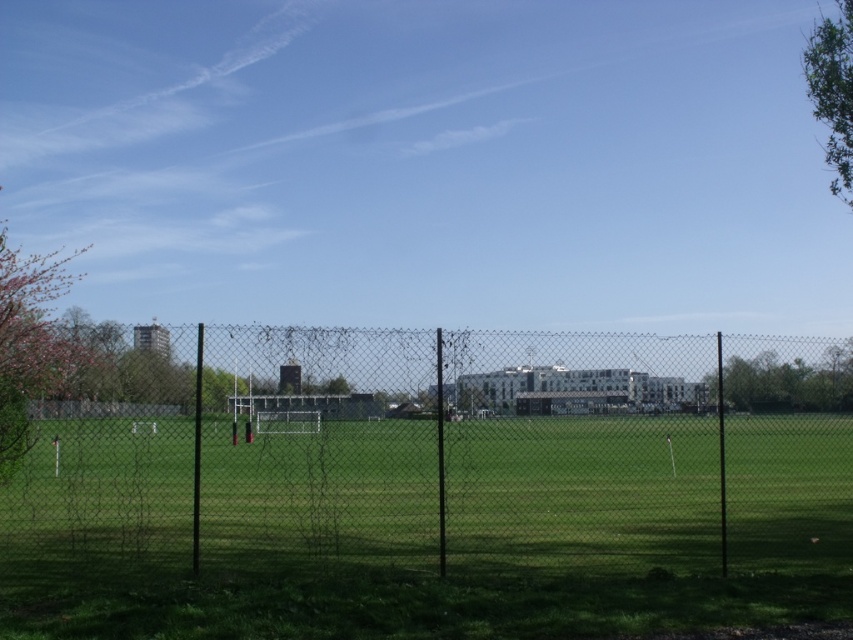
Question: Which is nearer to the green leafy tree at upper right?

Choices:
 (A) green leafy tree at right
 (B) metallic chain-link fence at center
 (C) pink blossoming tree at left

Answer: (B)

Question: Which of these objects is positioned closest to the green leafy tree at right?

Choices:
 (A) metallic chain-link fence at center
 (B) green leafy tree at upper right

Answer: (A)

Question: Which of the following is the farthest from the observer?

Choices:
 (A) (x=850, y=195)
 (B) (x=3, y=241)
 (C) (x=737, y=404)

Answer: (A)

Question: Is pink blossoming tree at left to the left of green leafy tree at right from the viewer's perspective?

Choices:
 (A) no
 (B) yes

Answer: (B)

Question: Is pink blossoming tree at left thinner than green leafy tree at right?

Choices:
 (A) no
 (B) yes

Answer: (A)

Question: Can you confirm if metallic chain-link fence at center is smaller than pink blossoming tree at left?

Choices:
 (A) yes
 (B) no

Answer: (A)